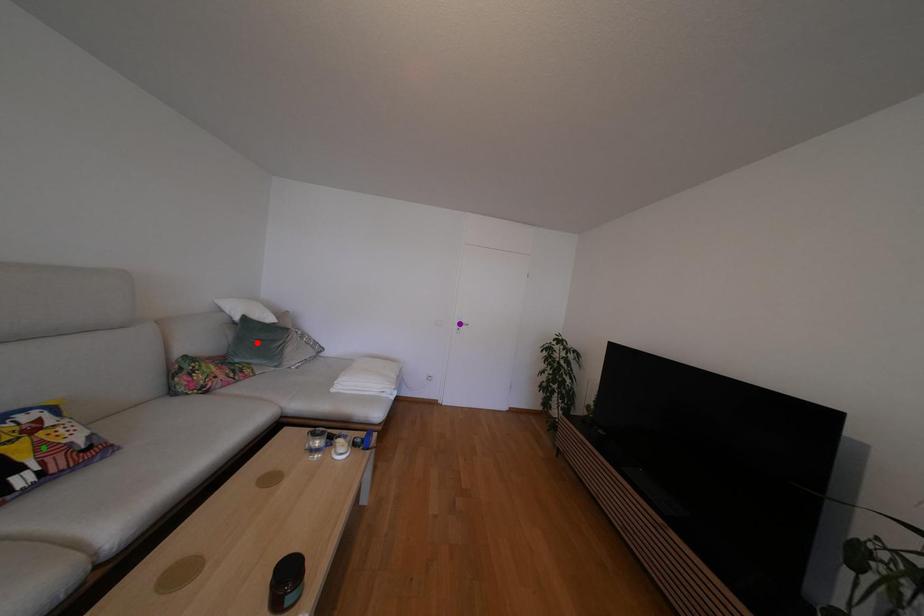
Order these from nearest to farthest:
green point, purple point, red point

green point < red point < purple point